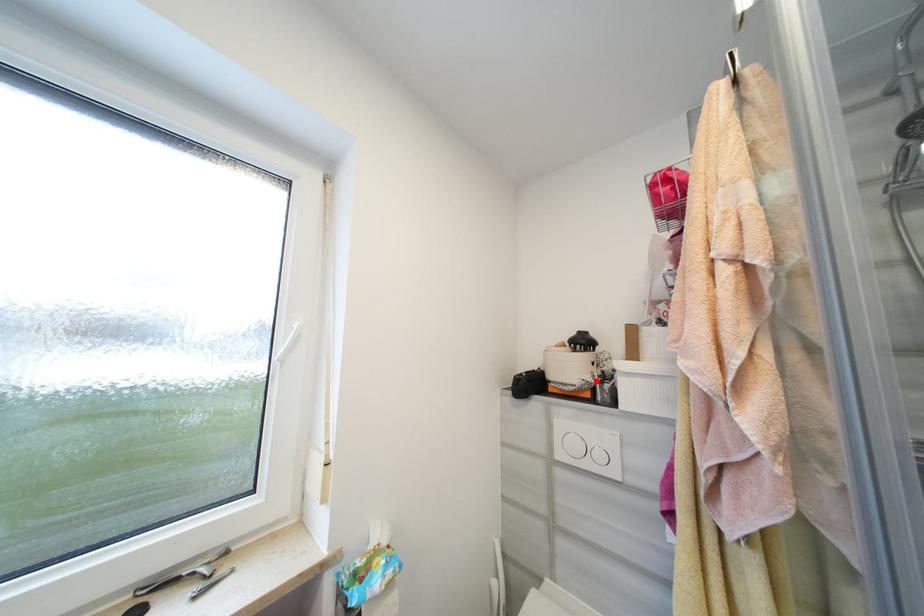
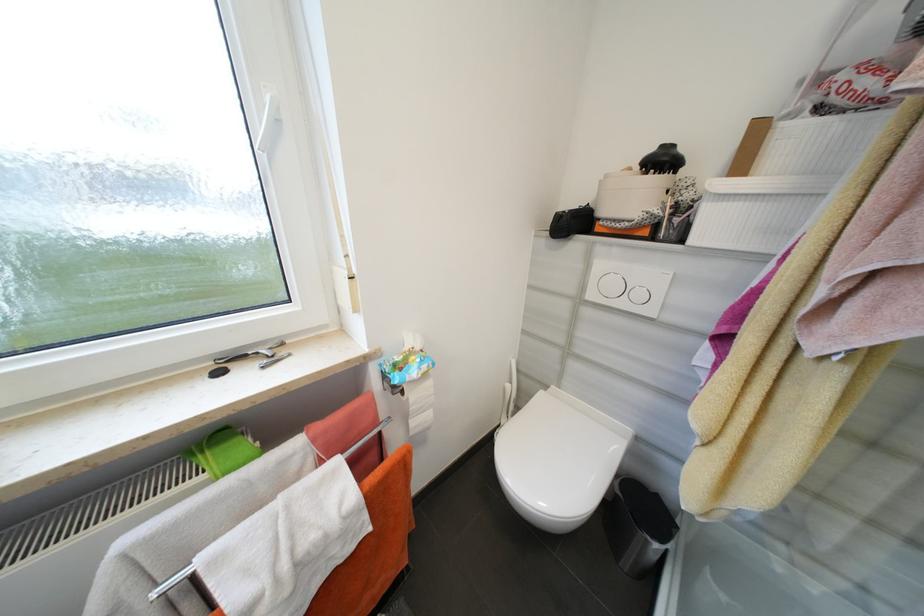
Find the pixel in the second image that matches the highlighted location in the first image.

(663, 213)